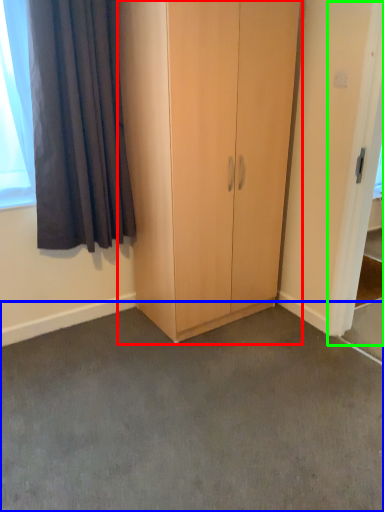
Question: Considering the real-world distances, which object is closest to cupboard (highlighted by a red box)? concrete (highlighted by a blue box) or screen door (highlighted by a green box).

Choices:
 (A) concrete
 (B) screen door

Answer: (B)